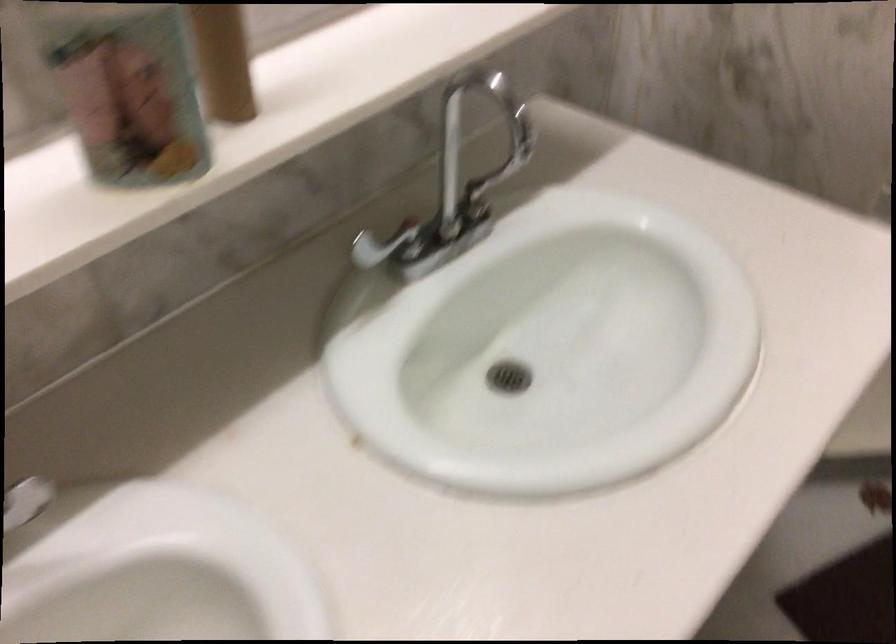
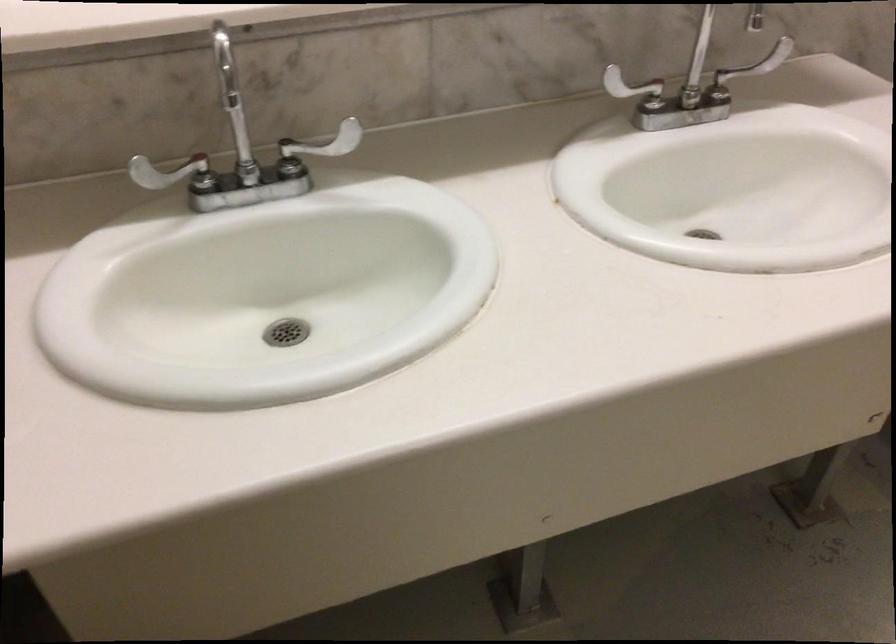
The point at [513,158] is marked in the first image. Where is the corresponding point in the second image?

(759, 62)